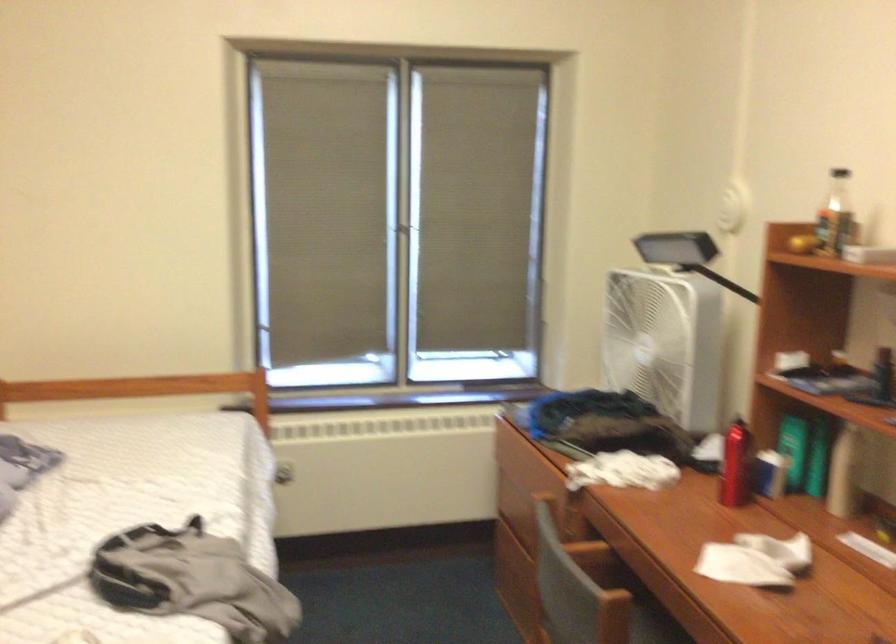
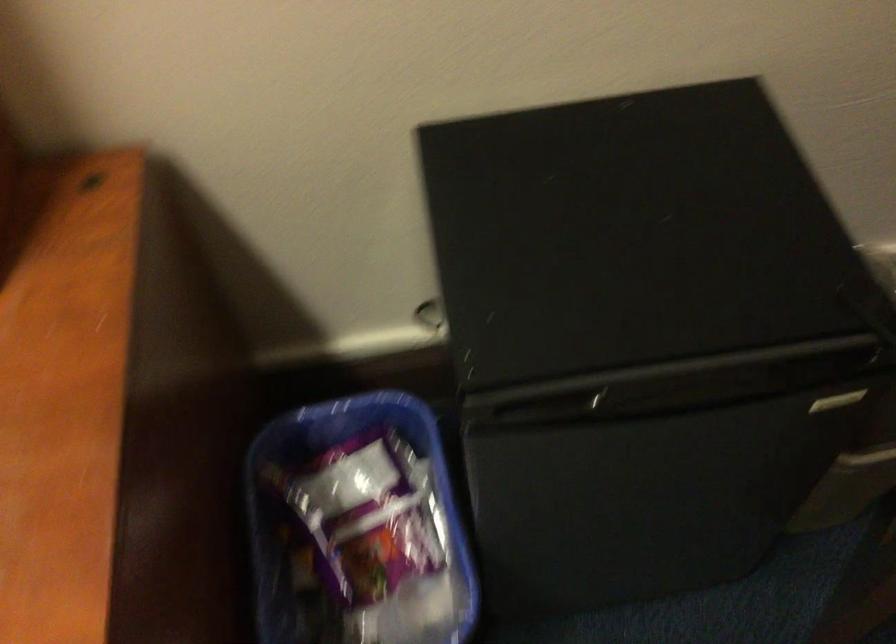
The images are taken continuously from a first-person perspective. In which direction is your viewpoint rotating?

The rotation direction of the camera is right-down.